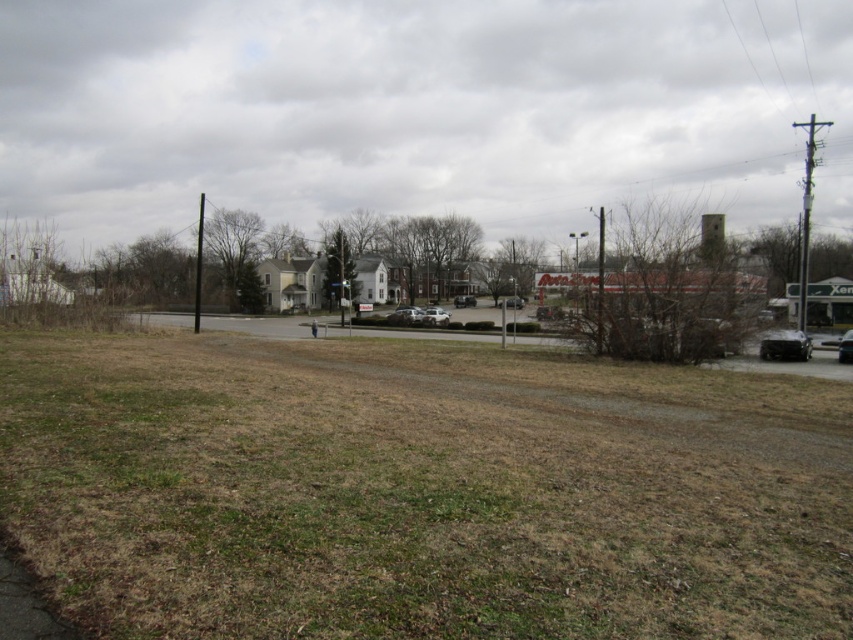
Does black matte car at lower right appear on the left side of silver metallic sedan at center?

No, black matte car at lower right is not to the left of silver metallic sedan at center.

You are a GUI agent. You are given a task and a screenshot of the screen. Output one action in this format:
    pyautogui.click(x=<x>, y=<y>)
    Task: Click on the black matte car at lower right
    The height and width of the screenshot is (640, 853).
    Given the screenshot: What is the action you would take?
    pyautogui.click(x=785, y=346)

Does metallic silver sedan at right have a larger size compared to metallic silver sedan at center?

Correct, metallic silver sedan at right is larger in size than metallic silver sedan at center.

Is point (845, 356) less distant than point (520, 300)?

Yes.

Who is more distant from viewer, (848, 355) or (519, 300)?

Point (519, 300)

Find the location of a particular element. metallic silver sedan at right is located at coordinates (845, 348).

Is metallic silver sedan at right below matte silver sedan at center?

Indeed, metallic silver sedan at right is positioned under matte silver sedan at center.

Which of these two, metallic silver sedan at right or matte silver sedan at center, stands shorter?

metallic silver sedan at right

Which is behind, point (849, 353) or point (465, 298)?

Point (465, 298)

Where is `metallic silver sedan at right`? The image size is (853, 640). metallic silver sedan at right is located at coordinates (845, 348).